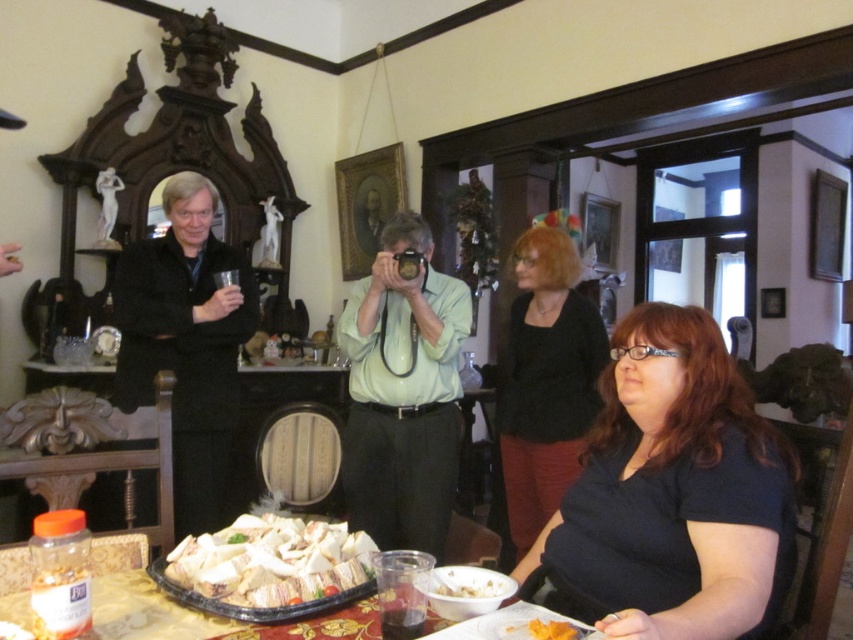
You are at a party and want to grab a snack from the table. There is a translucent plastic tray at lower center and a white creamy bowl at lower center. Which one is closer to you?

The translucent plastic tray at lower center is closer to you because it is in front of the white creamy bowl at lower center.

You are a guest at this gathering and want to reach for the white crumbly food at center. Since the black matte blouse at center is in the way, can you easily access the food without moving the blouse?

The white crumbly food at center is behind the black matte blouse at center, so you cannot easily access it without moving the blouse.

You are a guest at the gathering and want to reach for both the translucent plastic tray at lower center and the orange smoothie at lower center. If you can only extend your arm 60 centimeters, can you comfortably reach both items without moving your chair?

The distance between the translucent plastic tray at lower center and the orange smoothie at lower center is 55.09 centimeters. Since your arm can extend 60 centimeters, you can comfortably reach both items without needing to move your chair.